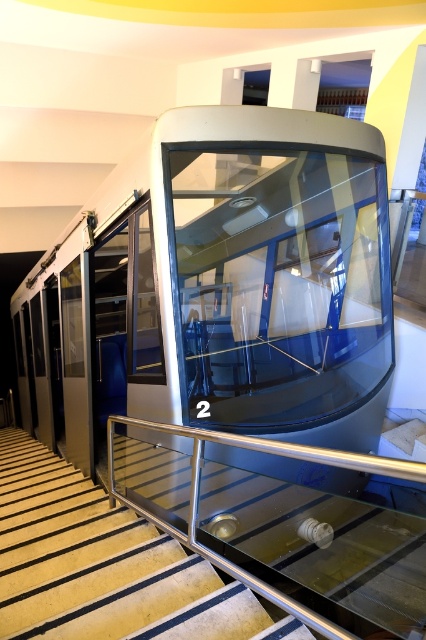
You are standing at the entrance of the museum and see the transparent glass train at center. If you want to walk directly towards it, which direction should you head? Please provide your answer based on the tram being at the specified coordinates.

The transparent glass train at center is located at coordinates point (219, 288), so you should head towards the center of the image to reach it.

In the scene shown: You are a visitor standing at the bottom of the stairs. You want to take a photo of the transparent glass train at center through the metallic glass stairs at center. Is the train visible through the stairs?

The transparent glass train at center is above metallic glass stairs at center, so yes, the train is visible through the metallic glass stairs at center from below.

You are standing in front of the tram and want to determine the position of two points marked on the stairs. Which point is closer to you, point at coordinate (264, 339) or point at coordinate (103, 596)?

Point at coordinate (103, 596) is closer to you because it is closer to the camera than point at coordinate (264, 339).